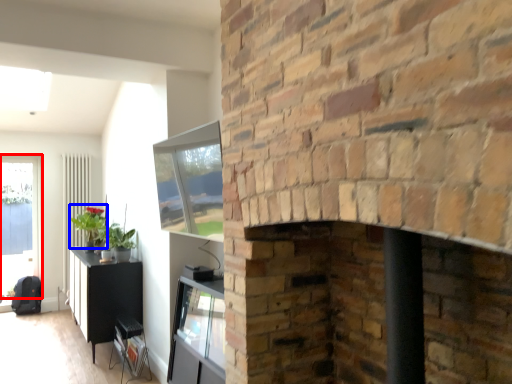
Question: Which of the following is the farthest to the observer, window (highlighted by a red box) or plant (highlighted by a blue box)?

Choices:
 (A) window
 (B) plant

Answer: (A)